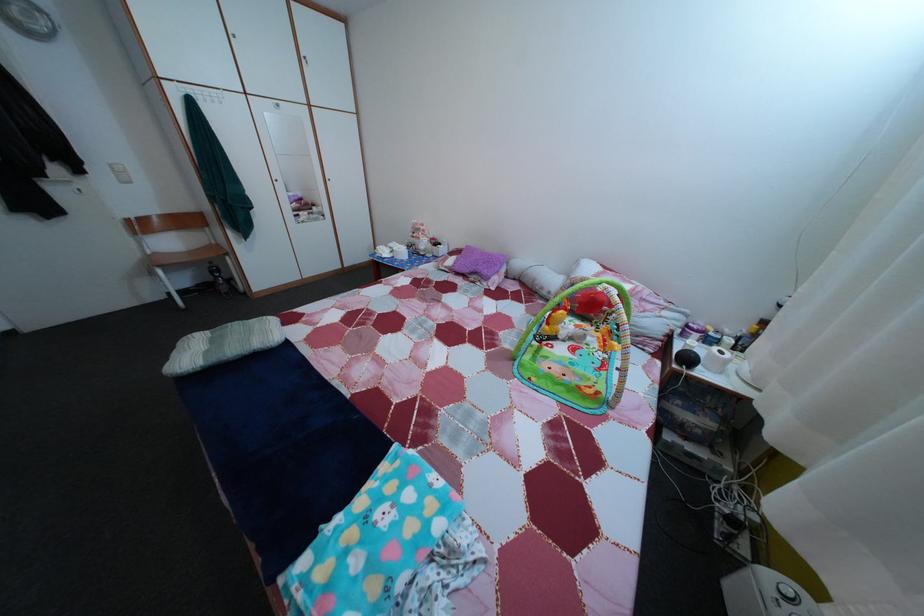
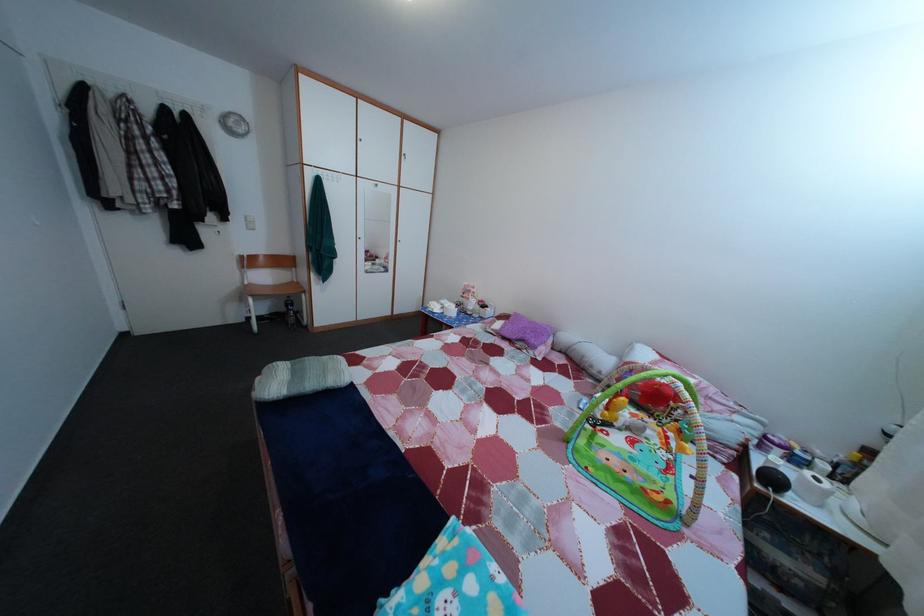
What movement of the cameraman would produce the second image?

The movement direction of the cameraman is left, backward.